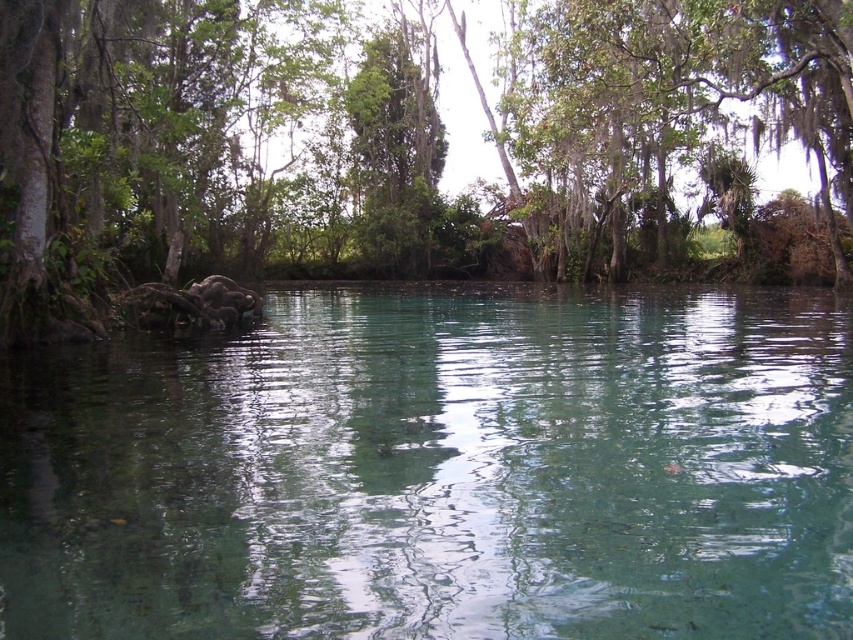
You are standing at the edge of the water and want to know which object is taller between the clear water at center and the green leafy tree at center. Which one is taller?

The green leafy tree at center is taller than the clear water at center.

You are a boat operator who needs to navigate a 10 feet long boat through the calm water. The boat requires at least 10 feet of space to move safely. Given the distance between the clear water at center and the green leafy tree at center, is there enough space for the boat to pass safely?

The clear water at center and the green leafy tree at center are 76.00 feet apart from each other. Since the boat requires at least 10 feet of space to move safely, the 76.00 feet distance between them provides ample space for the boat to pass safely.